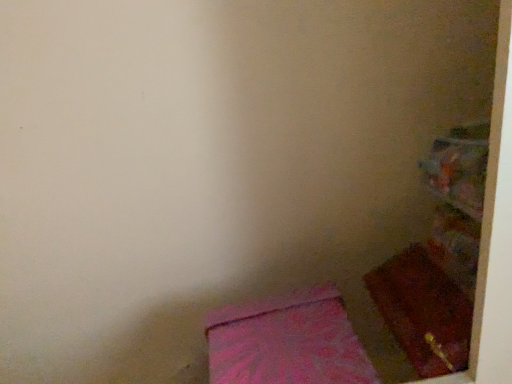
At what (x,y) coordinates should I click in order to perform the action: click on pink fabric at lower center. Please return your answer as a coordinate pair (x, y). Image resolution: width=512 pixels, height=384 pixels. Looking at the image, I should click on [287, 341].

This screenshot has height=384, width=512. Describe the element at coordinates (287, 341) in the screenshot. I see `pink fabric at lower center` at that location.

What are the coordinates of `pink fabric at lower center` in the screenshot? It's located at (287, 341).